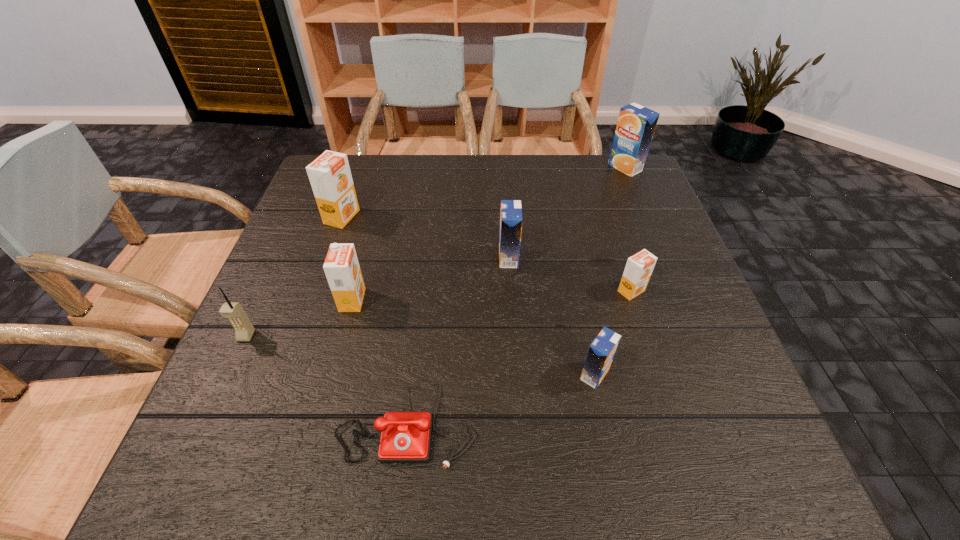
What are the coordinates of `blank region between the rightmost object and the fourth object from left to right` in the screenshot? It's located at coord(516,294).

The height and width of the screenshot is (540, 960). Identify the location of vacant space that is in between the rightmost blue orange_juice and the second object from left to right. (484, 192).

At what (x,y) coordinates should I click in order to perform the action: click on unoccupied area between the fourth orange juice from left to right and the leftmost blue orange_juice. Please return your answer as a coordinate pair (x, y). The image size is (960, 540). Looking at the image, I should click on (552, 316).

Locate an element on the screen. This screenshot has width=960, height=540. vacant area between the rightmost orange orange juice and the third object from left to right is located at coordinates (492, 295).

Find the location of a particular element. free spot between the leftmost object and the nearest blue orange_juice is located at coordinates (420, 355).

Identify which object is located as the sixth nearest to the telephone. Please provide its 2D coordinates. Your answer should be formatted as a tuple, i.e. [(x, y)], where the tuple contains the x and y coordinates of a point satisfying the conditions above.

[(329, 174)]

You are a GUI agent. You are given a task and a screenshot of the screen. Output one action in this format:
    pyautogui.click(x=<x>, y=<y>)
    Task: Click on the fourth closest object to the telephone
    The image size is (960, 540).
    Given the screenshot: What is the action you would take?
    pyautogui.click(x=511, y=219)

Identify the location of orange juice that stands as the closest to the smallest blue orange_juice. (639, 267).

Identify which orange juice is the second nearest to the second farthest blue orange_juice. Please provide its 2D coordinates. Your answer should be formatted as a tuple, i.e. [(x, y)], where the tuple contains the x and y coordinates of a point satisfying the conditions above.

[(601, 352)]

Point out which blue orange_juice is positioned as the second nearest to the seventh object from right to left. Please provide its 2D coordinates. Your answer should be formatted as a tuple, i.e. [(x, y)], where the tuple contains the x and y coordinates of a point satisfying the conditions above.

[(601, 352)]